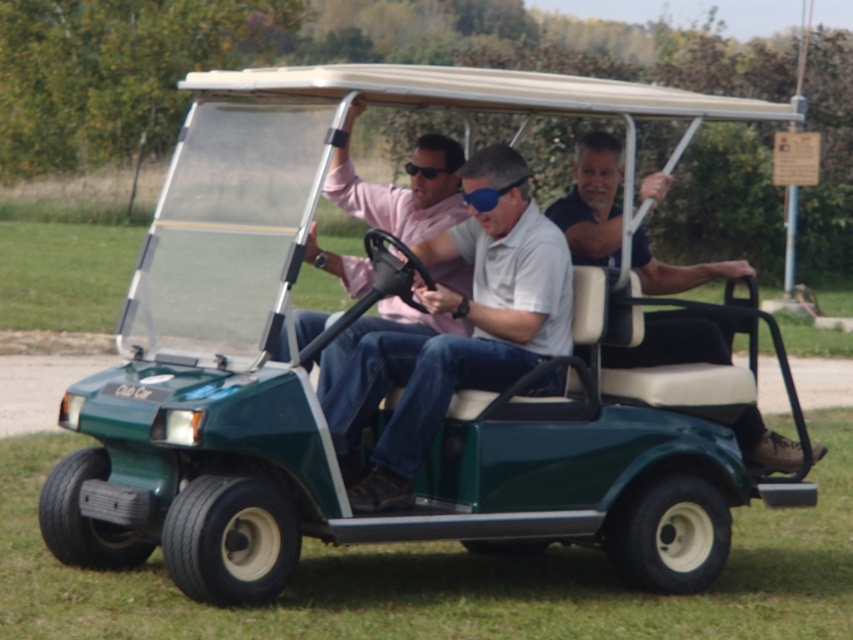
Question: Is light blue cotton shirt at center to the left of blue denim jeans at center from the viewer's perspective?

Choices:
 (A) yes
 (B) no

Answer: (A)

Question: Can you confirm if blue denim jeans at center is positioned below blue matte goggles at center?

Choices:
 (A) yes
 (B) no

Answer: (A)

Question: Is blue denim jeans at center closer to the viewer compared to blue matte goggles at center?

Choices:
 (A) yes
 (B) no

Answer: (A)

Question: Which point appears closest to the camera in this image?

Choices:
 (A) pos(430,173)
 (B) pos(599,179)
 (C) pos(376,461)

Answer: (C)

Question: Which of the following is the closest to the observer?

Choices:
 (A) blue matte goggles at center
 (B) blue denim jeans at center
 (C) light blue cotton shirt at center

Answer: (C)

Question: Among these objects, which one is farthest from the camera?

Choices:
 (A) blue denim jeans at center
 (B) blue matte goggles at center

Answer: (B)